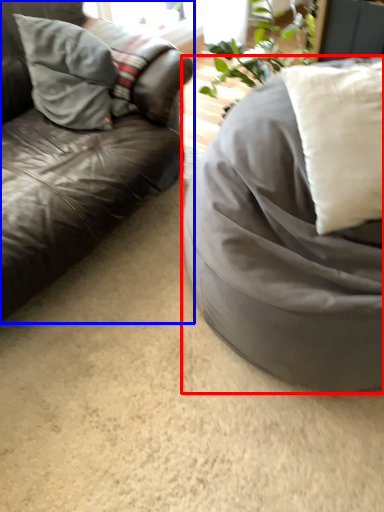
Question: Which object is closer to the camera taking this photo, furniture (highlighted by a red box) or studio couch (highlighted by a blue box)?

Choices:
 (A) furniture
 (B) studio couch

Answer: (A)